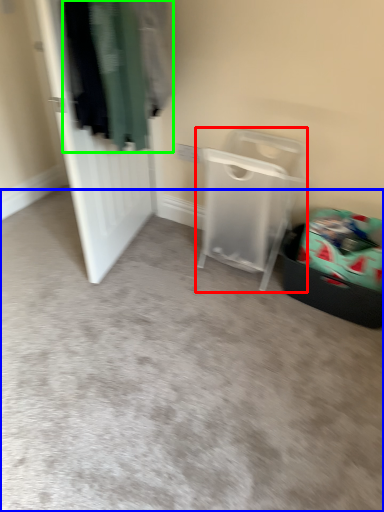
Question: Which object is the farthest from furniture (highlighted by a red box)? Choose among these: plain (highlighted by a blue box) or clothing (highlighted by a green box).

Choices:
 (A) plain
 (B) clothing

Answer: (B)